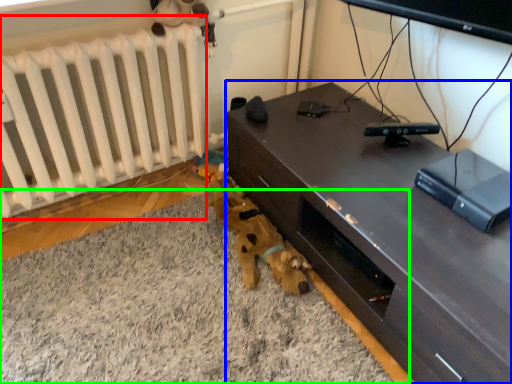
Question: Considering the real-world distances, which object is closest to radiator (highlighted by a red box)? desk (highlighted by a blue box) or plain (highlighted by a green box).

Choices:
 (A) desk
 (B) plain

Answer: (B)